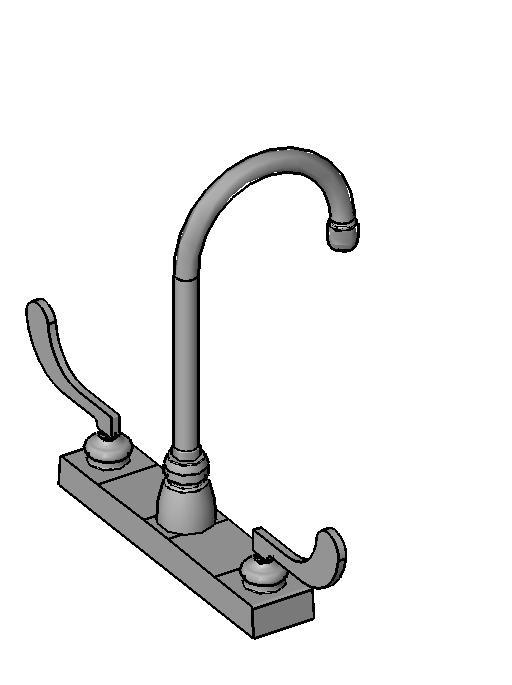
Locate an element on the screen. The width and height of the screenshot is (512, 685). 1screw for knob on the left side is located at coordinates (122, 448).